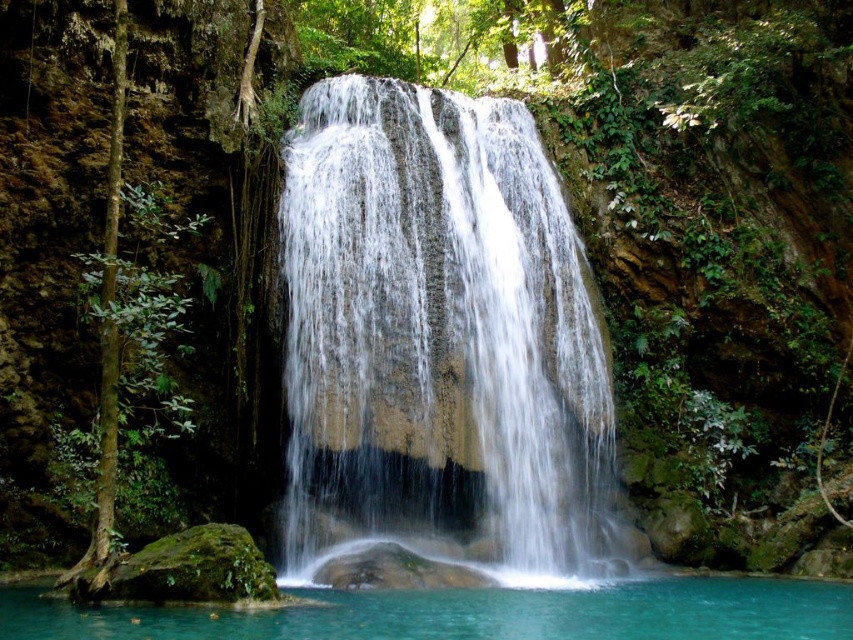
Which is more to the right, white smooth waterfall at center or turquoise water at center?

turquoise water at center is more to the right.

Who is positioned more to the left, white smooth waterfall at center or turquoise water at center?

white smooth waterfall at center is more to the left.

I want to click on white smooth waterfall at center, so click(x=440, y=340).